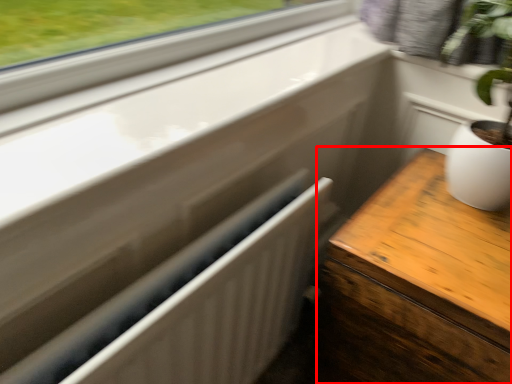
Question: Considering the relative positions of table (annotated by the red box) and radiator in the image provided, where is table (annotated by the red box) located with respect to the staircase?

Choices:
 (A) left
 (B) right

Answer: (B)